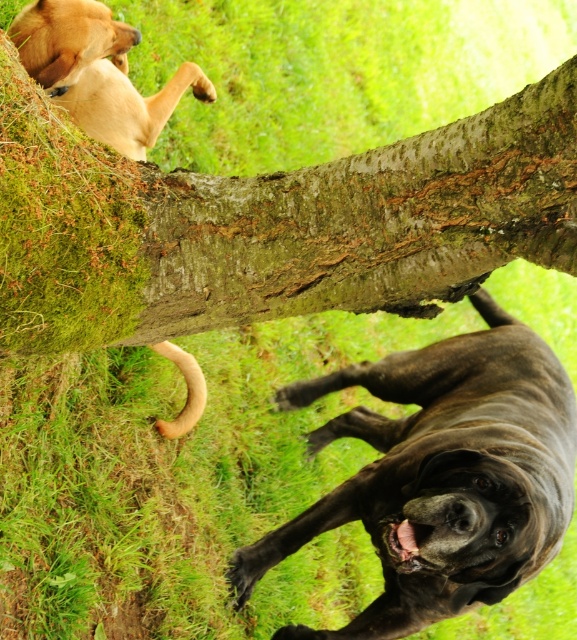
What do you see at coordinates (271, 224) in the screenshot? The height and width of the screenshot is (640, 577). I see `green mossy bark at upper center` at bounding box center [271, 224].

Which is in front, point (48, 163) or point (43, 38)?

Point (48, 163)

What do you see at coordinates (271, 224) in the screenshot? The width and height of the screenshot is (577, 640). I see `green mossy bark at upper center` at bounding box center [271, 224].

Image resolution: width=577 pixels, height=640 pixels. In order to click on green mossy bark at upper center in this screenshot , I will do `click(271, 224)`.

How far apart are green mossy bark at upper center and shiny brown dog at upper center?

green mossy bark at upper center and shiny brown dog at upper center are 1.09 meters apart.

Is green mossy bark at upper center taller than shiny brown dog at upper center?

No.

In the scene shown: Who is more forward, (x=394, y=241) or (x=563, y=452)?

Point (x=394, y=241)

Where is `green mossy bark at upper center`? The width and height of the screenshot is (577, 640). green mossy bark at upper center is located at coordinates (271, 224).

In the scene shown: Does shiny brown dog at upper center lie behind golden fur dog at upper left?

No, shiny brown dog at upper center is closer to the viewer.

Measure the distance between shiny brown dog at upper center and camera.

A distance of 7.17 feet exists between shiny brown dog at upper center and camera.

At what (x,y) coordinates should I click in order to perform the action: click on shiny brown dog at upper center. Please return your answer as a coordinate pair (x, y). Image resolution: width=577 pixels, height=640 pixels. Looking at the image, I should click on (440, 476).